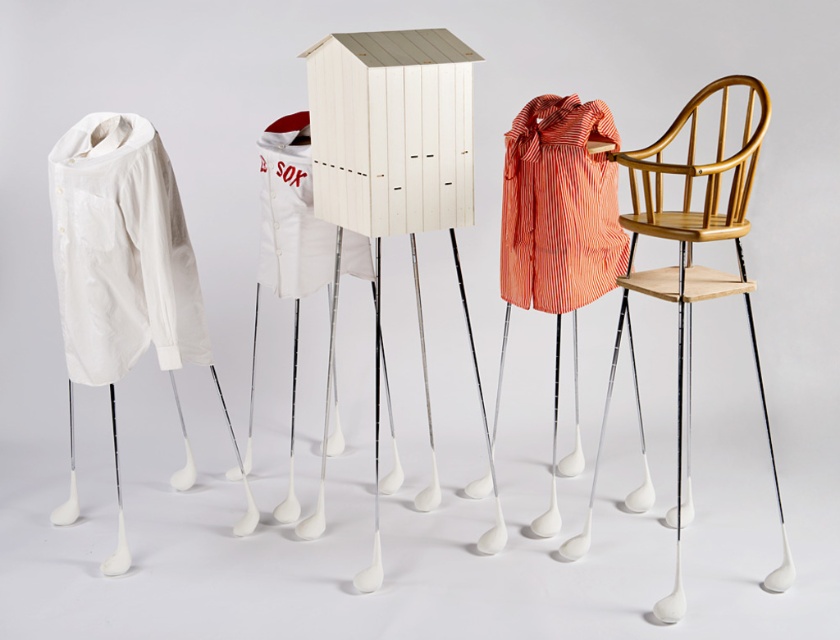
You are an assistant trying to locate the white fabric shirt at left in the image. What are the coordinates of its position?

The coordinates of the white fabric shirt at left are at point (x=126, y=273).

You are a parent trying to store a wooden high chair at right and a striped cotton shirt at right in a small closet. Which object should you prioritize placing first to maximize space efficiency?

The wooden high chair at right is bigger than the striped cotton shirt at right, so you should prioritize placing the wooden high chair at right first to maximize space efficiency.